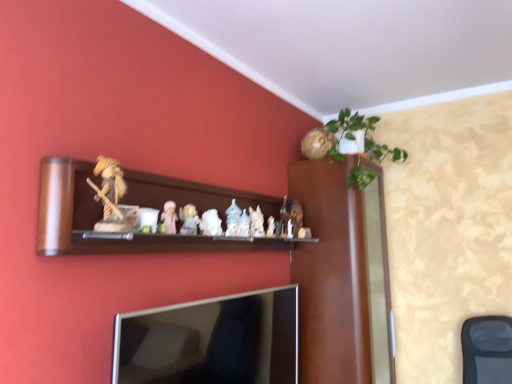
Question: Is white porcelain figurine at center, the fourth toy positioned from the left, bigger than white porcelain figurines at center, the fourth toy from the right?

Choices:
 (A) no
 (B) yes

Answer: (B)

Question: Does white porcelain figurine at center, the 3th toy when ordered from right to left, come in front of white porcelain figurines at center, acting as the 3th toy starting from the front?

Choices:
 (A) no
 (B) yes

Answer: (A)

Question: Considering the relative sizes of white porcelain figurine at center, which ranks as the 4th toy in front-to-back order, and white porcelain figurines at center, placed as the fourth toy when sorted from back to front, in the image provided, is white porcelain figurine at center, which ranks as the 4th toy in front-to-back order, taller than white porcelain figurines at center, placed as the fourth toy when sorted from back to front,?

Choices:
 (A) no
 (B) yes

Answer: (A)

Question: Is white porcelain figurine at center, which ranks as the 4th toy in front-to-back order, far away from white porcelain figurines at center, the third toy positioned from the left?

Choices:
 (A) yes
 (B) no

Answer: (B)

Question: Can you confirm if white porcelain figurine at center, the fourth toy positioned from the left, is wider than white porcelain figurines at center, the fourth toy from the right?

Choices:
 (A) no
 (B) yes

Answer: (B)

Question: Is white porcelain figurines at center, placed as the fourth toy when sorted from back to front, inside white porcelain figurine at center, the fourth toy positioned from the left?

Choices:
 (A) yes
 (B) no

Answer: (B)

Question: Can you confirm if black mesh swivel chair at lower right is bigger than fuzzy brown figure at upper center, the first toy when ordered from front to back?

Choices:
 (A) no
 (B) yes

Answer: (B)

Question: From the image's perspective, is black mesh swivel chair at lower right on top of fuzzy brown figure at upper center, the first toy when ordered from front to back?

Choices:
 (A) no
 (B) yes

Answer: (A)

Question: From a real-world perspective, is black mesh swivel chair at lower right beneath fuzzy brown figure at upper center, the first toy when ordered from front to back?

Choices:
 (A) no
 (B) yes

Answer: (B)

Question: Is black mesh swivel chair at lower right thinner than fuzzy brown figure at upper center, which is the sixth toy in right-to-left order?

Choices:
 (A) no
 (B) yes

Answer: (A)

Question: Can you confirm if black mesh swivel chair at lower right is smaller than fuzzy brown figure at upper center, the 6th toy in the back-to-front sequence?

Choices:
 (A) yes
 (B) no

Answer: (B)

Question: Does black mesh swivel chair at lower right touch fuzzy brown figure at upper center, the 6th toy in the back-to-front sequence?

Choices:
 (A) yes
 (B) no

Answer: (B)

Question: From a real-world perspective, is porcelain figurine at center, the second toy when ordered from front to back, over silver metallic tv at lower center?

Choices:
 (A) no
 (B) yes

Answer: (B)